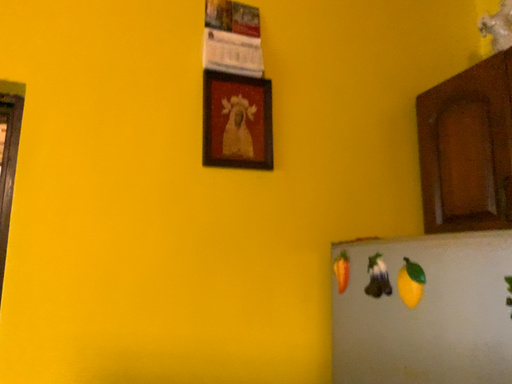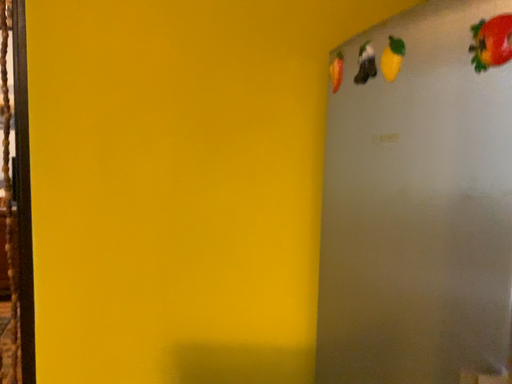
Question: How did the camera likely rotate when shooting the video?

Choices:
 (A) rotated downward
 (B) rotated upward

Answer: (A)